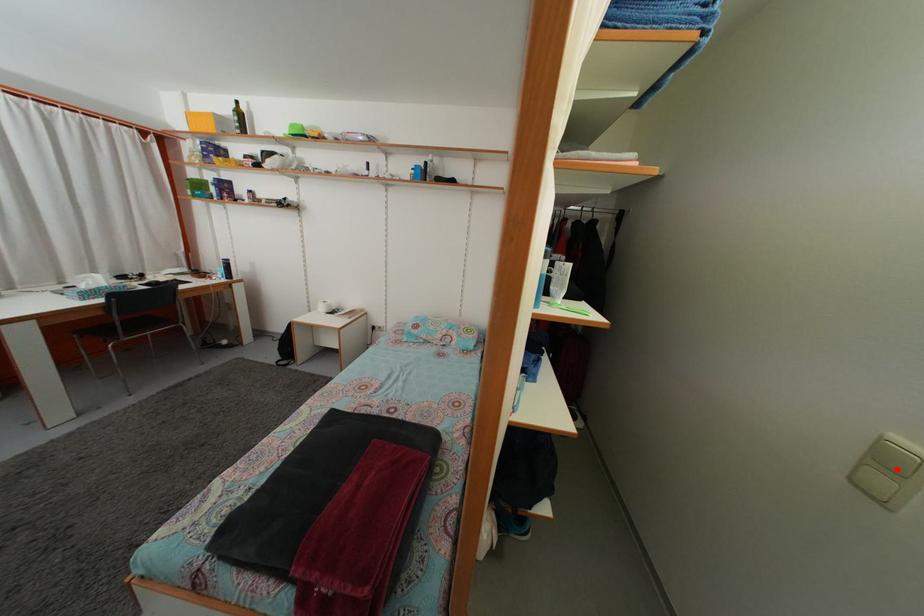
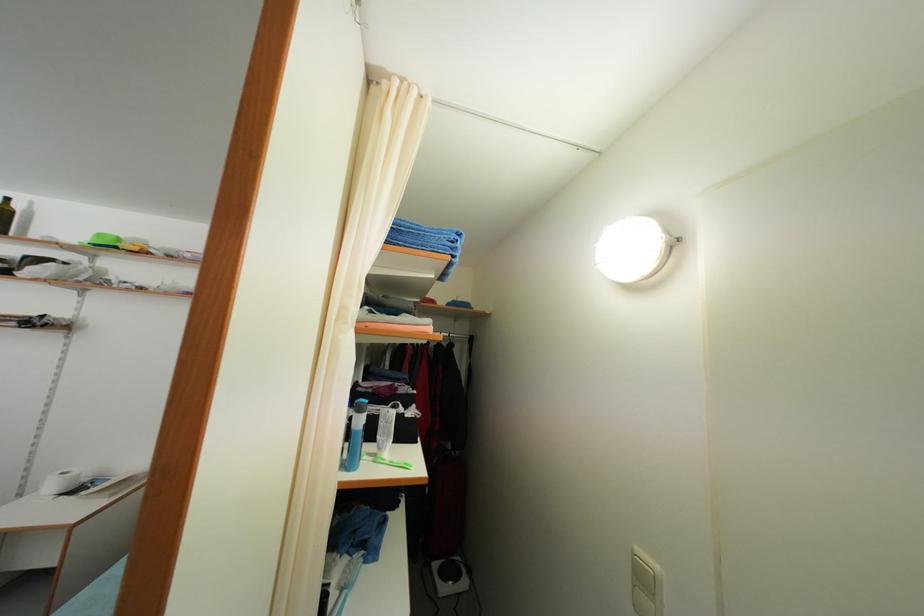
In the second image, find the point that corresponds to the highlighted location in the first image.

(649, 586)